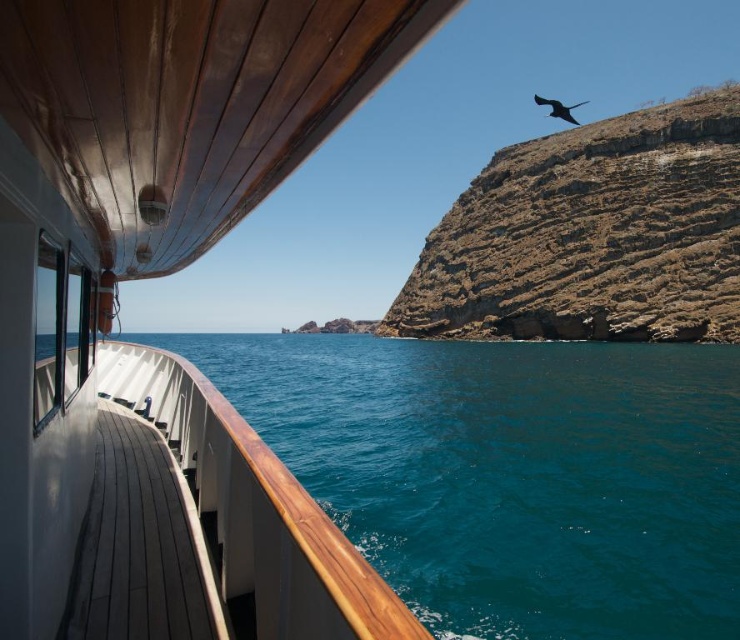
Question: Which object is positioned farthest from the wooden deck at lower left?

Choices:
 (A) brown rocky cliff at upper right
 (B) teal glossy water at lower left
 (C) dark gray glossy bird at upper right

Answer: (C)

Question: Can you confirm if wooden deck at left is bigger than teal glossy water at lower left?

Choices:
 (A) yes
 (B) no

Answer: (B)

Question: Is the position of wooden deck at left less distant than that of dark gray glossy bird at upper right?

Choices:
 (A) yes
 (B) no

Answer: (A)

Question: Which object is positioned farthest from the wooden deck at left?

Choices:
 (A) dark gray glossy bird at upper right
 (B) brown rocky cliff at upper right
 (C) wooden deck at lower left

Answer: (A)

Question: Which of these objects is positioned closest to the wooden deck at lower left?

Choices:
 (A) dark gray glossy bird at upper right
 (B) brown rocky cliff at upper right
 (C) wooden deck at left

Answer: (C)

Question: Can you confirm if teal glossy water at lower left is positioned below brown rocky cliff at upper right?

Choices:
 (A) no
 (B) yes

Answer: (B)